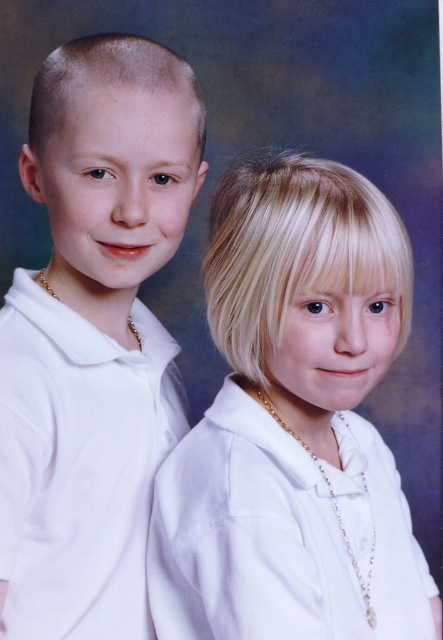
Question: Can you confirm if blonde hair at center is wider than matte white shirt at left?

Choices:
 (A) no
 (B) yes

Answer: (B)

Question: Can you confirm if blonde hair at center is wider than matte white shirt at left?

Choices:
 (A) yes
 (B) no

Answer: (A)

Question: Which of the following is the farthest from the observer?

Choices:
 (A) (245, 612)
 (B) (154, 189)

Answer: (B)

Question: Can you confirm if blonde hair at center is smaller than matte white shirt at left?

Choices:
 (A) yes
 (B) no

Answer: (B)

Question: Which point is farther to the camera?

Choices:
 (A) (260, 196)
 (B) (144, 128)

Answer: (A)